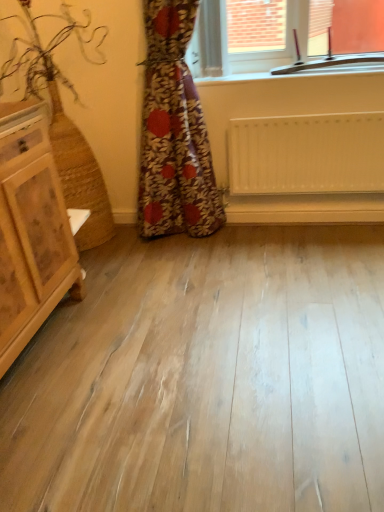
Question: From a real-world perspective, does clear glass window at upper center stand above white matte radiator at center?

Choices:
 (A) no
 (B) yes

Answer: (B)

Question: Does clear glass window at upper center have a greater width compared to white matte radiator at center?

Choices:
 (A) no
 (B) yes

Answer: (B)

Question: Is clear glass window at upper center smaller than white matte radiator at center?

Choices:
 (A) yes
 (B) no

Answer: (B)

Question: Would you say clear glass window at upper center contains white matte radiator at center?

Choices:
 (A) yes
 (B) no

Answer: (B)

Question: Does clear glass window at upper center come behind white matte radiator at center?

Choices:
 (A) no
 (B) yes

Answer: (A)

Question: Considering the positions of point (289, 158) and point (261, 65), is point (289, 158) closer or farther from the camera than point (261, 65)?

Choices:
 (A) farther
 (B) closer

Answer: (B)

Question: Looking at their shapes, would you say white matte radiator at center is wider or thinner than clear glass window at upper center?

Choices:
 (A) wide
 (B) thin

Answer: (B)

Question: Would you say white matte radiator at center is inside or outside clear glass window at upper center?

Choices:
 (A) inside
 (B) outside

Answer: (B)

Question: From a real-world perspective, is white matte radiator at center physically located above or below clear glass window at upper center?

Choices:
 (A) above
 (B) below

Answer: (B)

Question: Is floral fabric curtain at center in front of or behind white matte radiator at center in the image?

Choices:
 (A) behind
 (B) front

Answer: (B)

Question: From a real-world perspective, is floral fabric curtain at center above or below white matte radiator at center?

Choices:
 (A) above
 (B) below

Answer: (A)

Question: Considering the positions of floral fabric curtain at center and white matte radiator at center in the image, is floral fabric curtain at center bigger or smaller than white matte radiator at center?

Choices:
 (A) small
 (B) big

Answer: (B)

Question: From the image's perspective, is floral fabric curtain at center above or below white matte radiator at center?

Choices:
 (A) below
 (B) above

Answer: (B)

Question: In the image, is floral fabric curtain at center positioned in front of or behind clear glass window at upper center?

Choices:
 (A) front
 (B) behind

Answer: (A)

Question: Considering the relative positions of floral fabric curtain at center and clear glass window at upper center in the image provided, is floral fabric curtain at center to the left or to the right of clear glass window at upper center?

Choices:
 (A) left
 (B) right

Answer: (A)